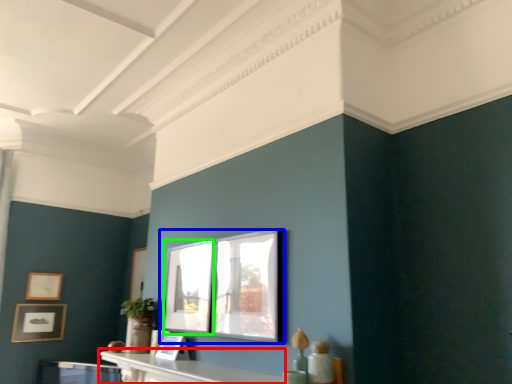
Question: Based on their relative distances, which object is farther from table (highlighted by a red box)? Choose from picture frame (highlighted by a blue box) and window (highlighted by a green box).

Choices:
 (A) picture frame
 (B) window

Answer: (B)